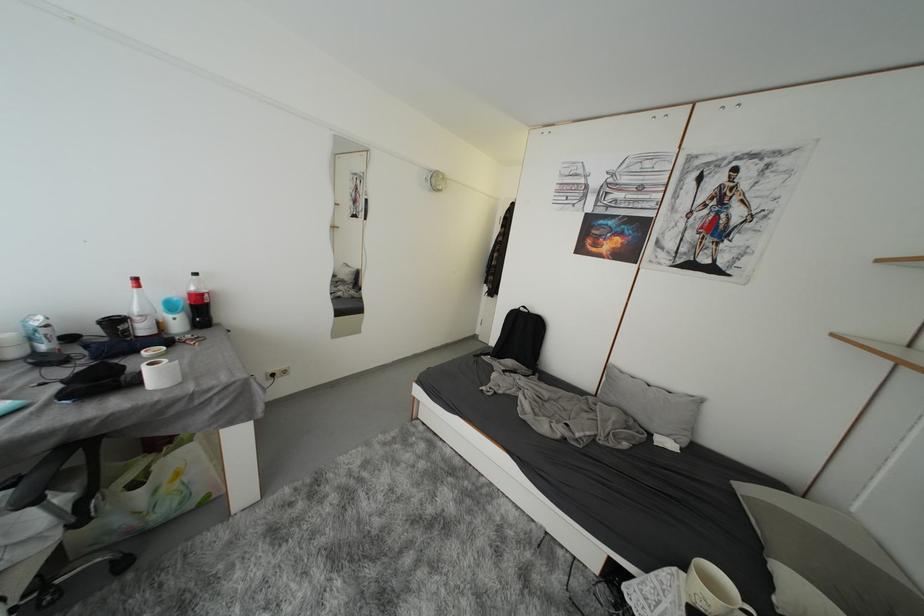
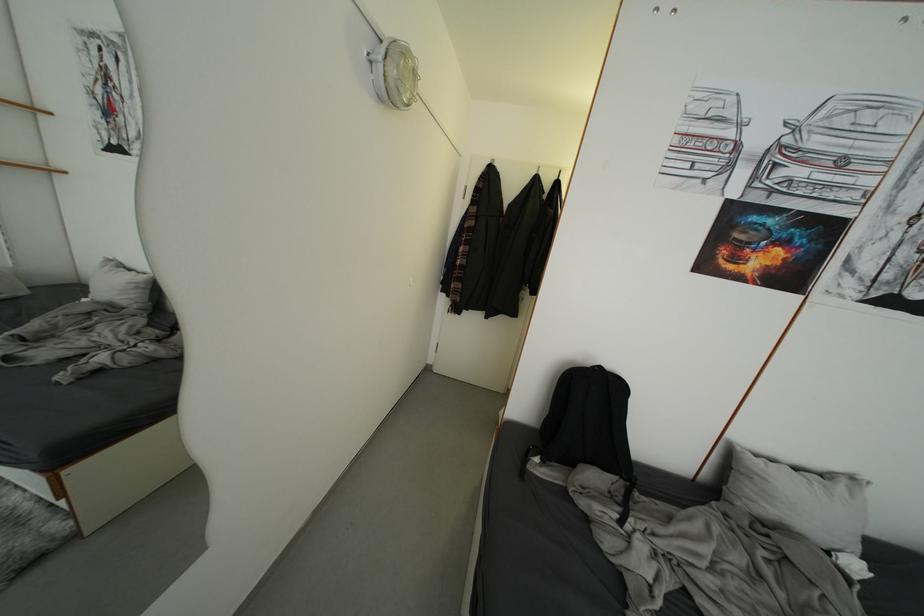
In a continuous first-person perspective shot, in which direction is the camera moving?

The cameraman moved toward left, forward.